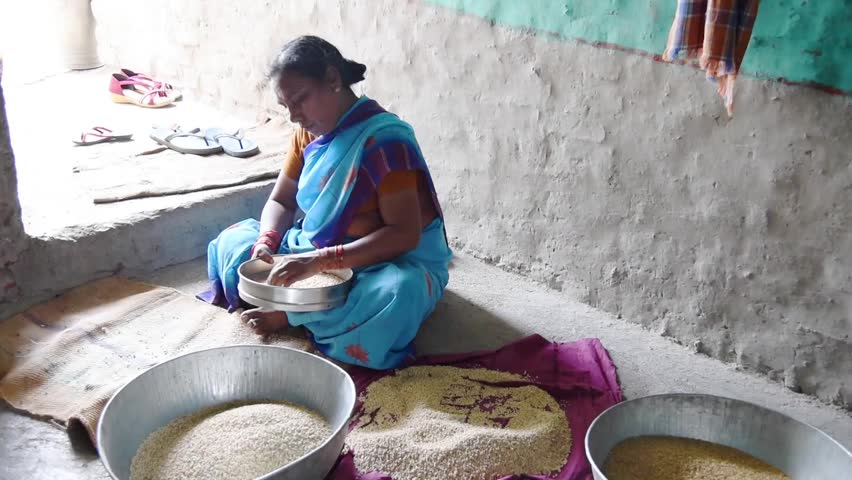
Locate an element on the screen. The width and height of the screenshot is (852, 480). painting is located at coordinates (613, 20).